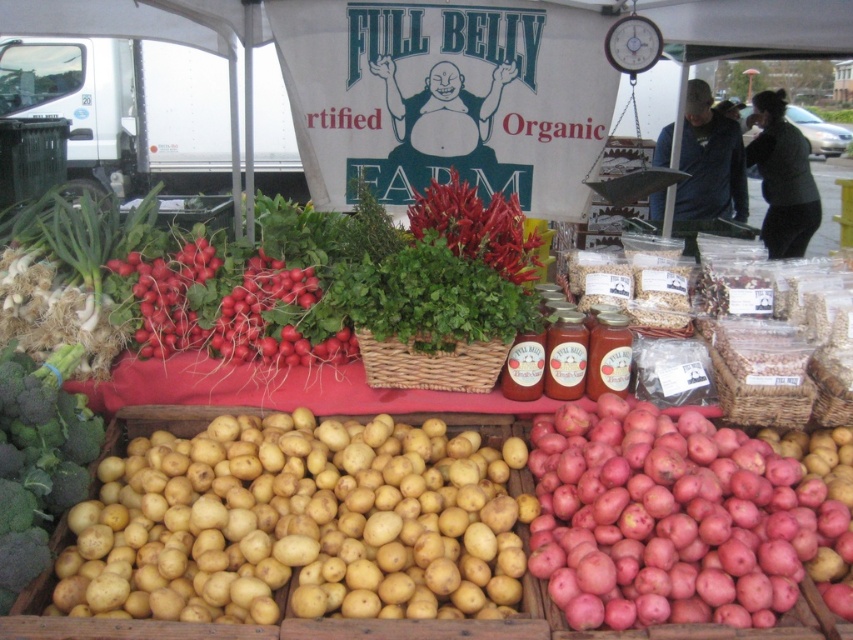
You are a customer at the farmer market stall. You want to place a jar of pickled peppers between the red matte potatoes at lower right and the bright red chili peppers at center. The jar is 20 centimeters wide. Is there enough space between the two items to place the jar?

The distance between the red matte potatoes at lower right and the bright red chili peppers at center is 79.14 centimeters. Since the jar is only 20 centimeters wide, there is sufficient space to place it between them.

You are a photographer standing at the farmer market stall. You want to take a close up photo of the red matte potatoes at lower right. The camera you are using has a minimum focusing distance of 1.5 meters. Will you be able to take the photo without moving closer?

The distance between the red matte potatoes at lower right and the camera is 1.73 meters. Since the minimum focusing distance of the camera is 1.5 meters, you can take the close up photo without moving closer because the current distance is within the camera range.

You are a customer at the farmer market stall and want to buy both the yellow matte potatoes at lower left and the green leafy broccoli at lower left. If you are standing in front of the stall, which item would you reach first if you move towards the left side of the stall?

The green leafy broccoli at lower left would be reached first since it is positioned to the left of the yellow matte potatoes at lower left.